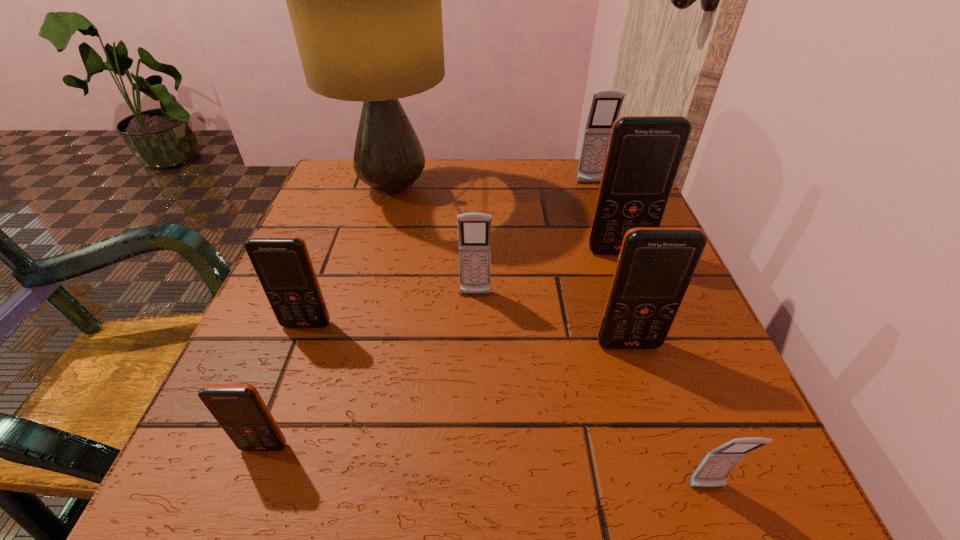
Choose which orange cellular telephone is the third nearest neighbor to the nearest gray cellular telephone. Please provide its 2D coordinates. Your answer should be formatted as a tuple, i.e. [(x, y)], where the tuple contains the x and y coordinates of a point satisfying the conditions above.

[(239, 409)]

The height and width of the screenshot is (540, 960). I want to click on the second closest orange cellular telephone to the farthest orange cellular telephone, so click(x=282, y=263).

Where is `gray cellular telephone that stands as the second closest to the farthest cellular telephone`? This screenshot has height=540, width=960. gray cellular telephone that stands as the second closest to the farthest cellular telephone is located at coordinates (713, 470).

Identify which gray cellular telephone is located as the second nearest to the farthest cellular telephone. Please provide its 2D coordinates. Your answer should be formatted as a tuple, i.e. [(x, y)], where the tuple contains the x and y coordinates of a point satisfying the conditions above.

[(713, 470)]